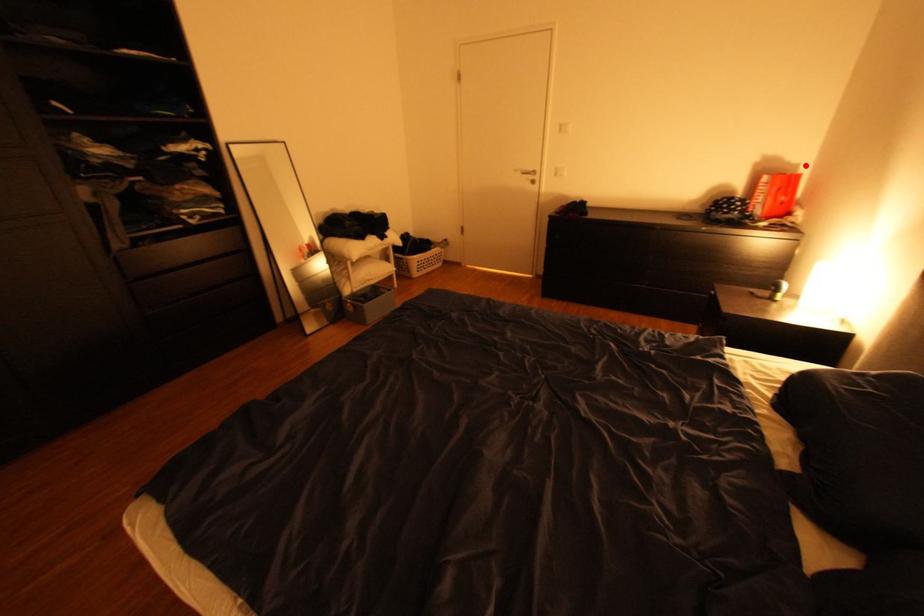
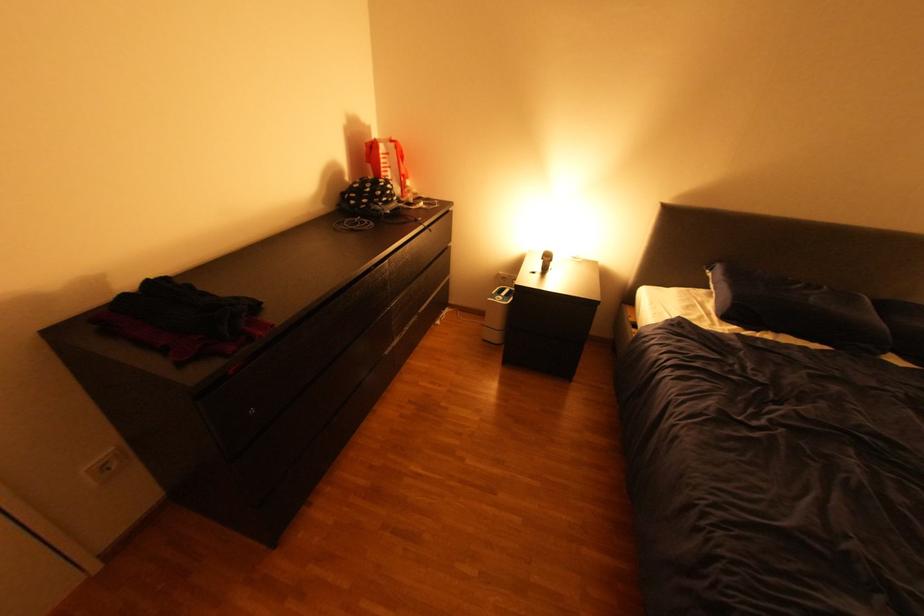
Question: I am providing you with two images of the same scene from different viewpoints. A red point is shown in image1. For the corresponding object point in image2, is it positioned nearer or farther from the camera?

Choices:
 (A) Nearer
 (B) Farther

Answer: (A)